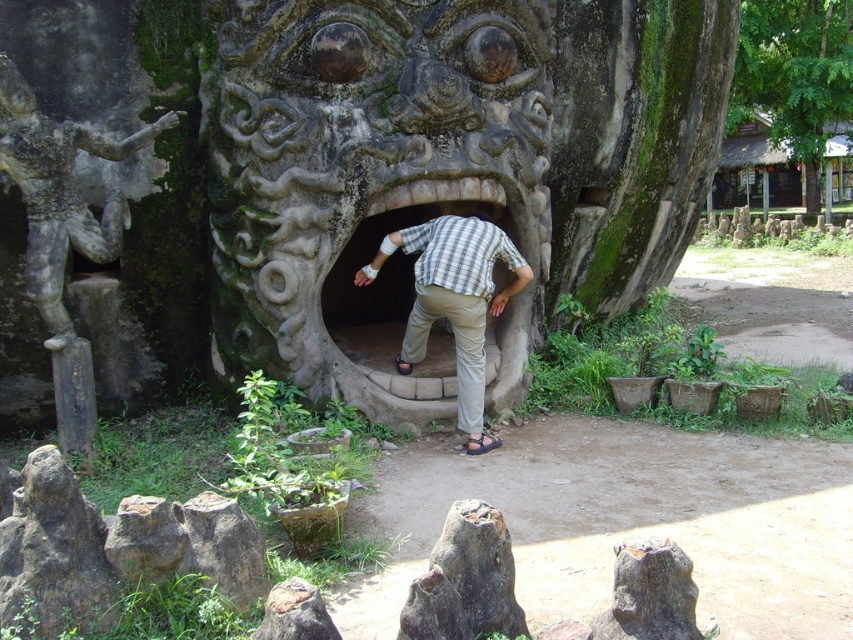
Is stone statue at left positioned behind green leafy tree at upper right?

No.

Does stone statue at left appear on the right side of green leafy tree at upper right?

Incorrect, stone statue at left is not on the right side of green leafy tree at upper right.

Who is more forward, (115, 150) or (811, 92)?

Point (115, 150) is in front.

Locate an element on the screen. This screenshot has width=853, height=640. stone statue at left is located at coordinates (59, 193).

Does stone statue at left appear on the right side of plaid shirt at center?

In fact, stone statue at left is to the left of plaid shirt at center.

Who is higher up, stone statue at left or plaid shirt at center?

stone statue at left is above.

This screenshot has width=853, height=640. What do you see at coordinates (59, 193) in the screenshot?
I see `stone statue at left` at bounding box center [59, 193].

The width and height of the screenshot is (853, 640). I want to click on stone statue at left, so click(59, 193).

Measure the distance between point (x=807, y=128) and camera.

17.00 meters

Is green leafy tree at upper right below plaid shirt at center?

No.

Describe the element at coordinates (793, 76) in the screenshot. This screenshot has height=640, width=853. I see `green leafy tree at upper right` at that location.

Where is `green leafy tree at upper right`? The width and height of the screenshot is (853, 640). green leafy tree at upper right is located at coordinates (793, 76).